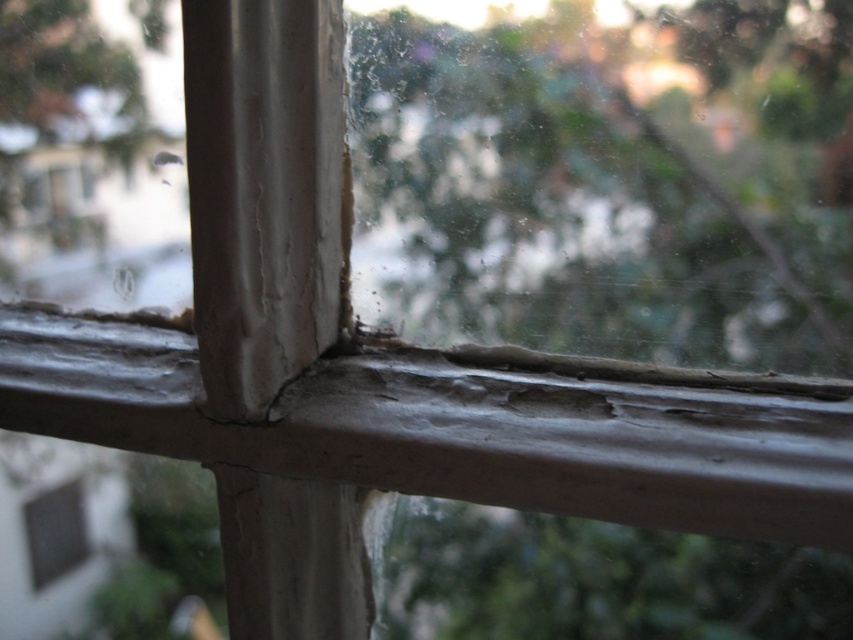
Question: Which point is farther from the camera taking this photo?

Choices:
 (A) (544, 243)
 (B) (21, 508)

Answer: (B)

Question: Which point appears farthest from the camera in this image?

Choices:
 (A) (578, 131)
 (B) (33, 584)

Answer: (B)

Question: Does green leafy tree at center appear over matte gray window at lower left?

Choices:
 (A) no
 (B) yes

Answer: (B)

Question: Does green leafy tree at center appear on the right side of matte gray window at lower left?

Choices:
 (A) yes
 (B) no

Answer: (A)

Question: Which point is farther to the camera?

Choices:
 (A) (49, 550)
 (B) (637, 353)

Answer: (A)

Question: Does green leafy tree at center have a larger size compared to matte gray window at lower left?

Choices:
 (A) yes
 (B) no

Answer: (A)